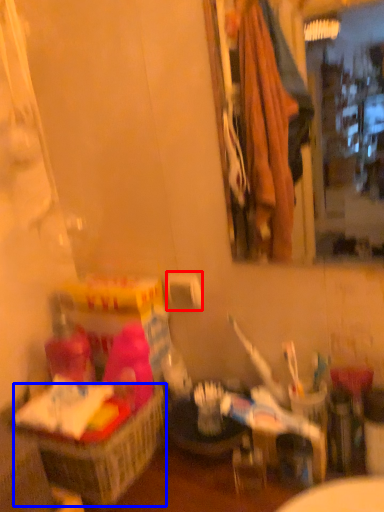
Question: Which of the following is the closest to the observer, toilet paper (highlighted by a red box) or basket (highlighted by a blue box)?

Choices:
 (A) toilet paper
 (B) basket

Answer: (B)